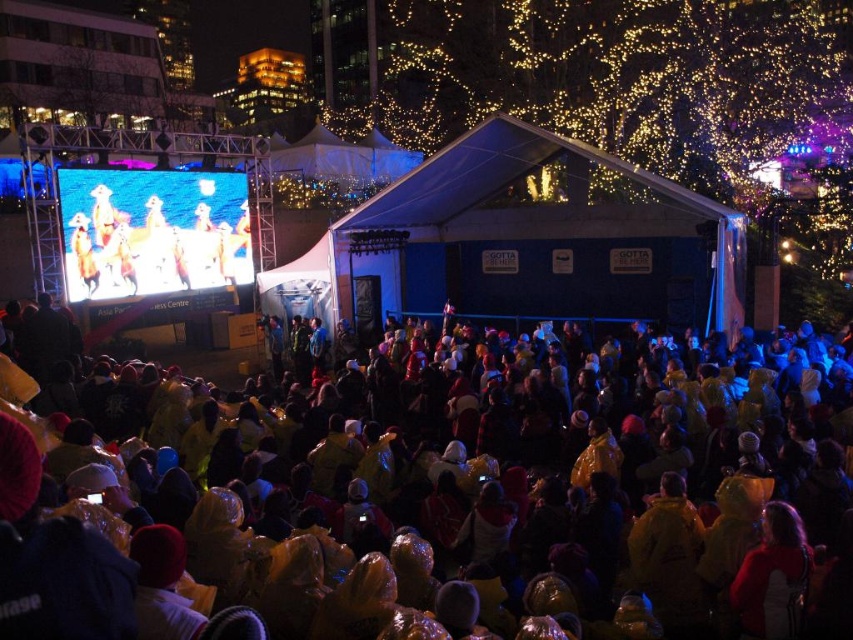
You are at the event and want to take a photo of the yellow raincoats at lower center without the matte black screen at upper left in the frame. Which direction should you move to achieve this?

Move to the left so that the yellow raincoats at lower center stays in frame while the matte black screen at upper left is no longer visible.

You are an event organizer checking the stage setup. You notice the yellow raincoats at lower center and the matte black screen at upper left. Which object is closer to the audience standing in front of the stage?

The yellow raincoats at lower center are closer to the audience because they are positioned in front of the matte black screen at upper left.

You are a photographer at the event and want to capture a photo that includes both the yellow raincoats at lower center and the matte black screen at upper left. Given that your camera has a maximum focus range of 20 meters, will you be able to take the photo with both objects in focus?

The yellow raincoats at lower center and the matte black screen at upper left are 20.29 meters apart. Since the camera can only focus up to 20 meters, the distance is slightly beyond the camera capabilities, so the photo may not have both objects in focus.